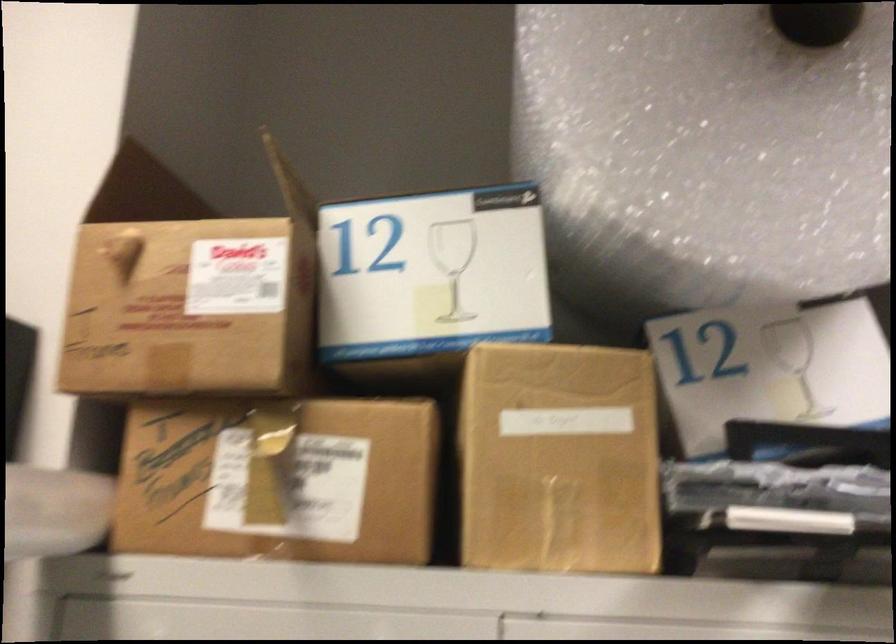
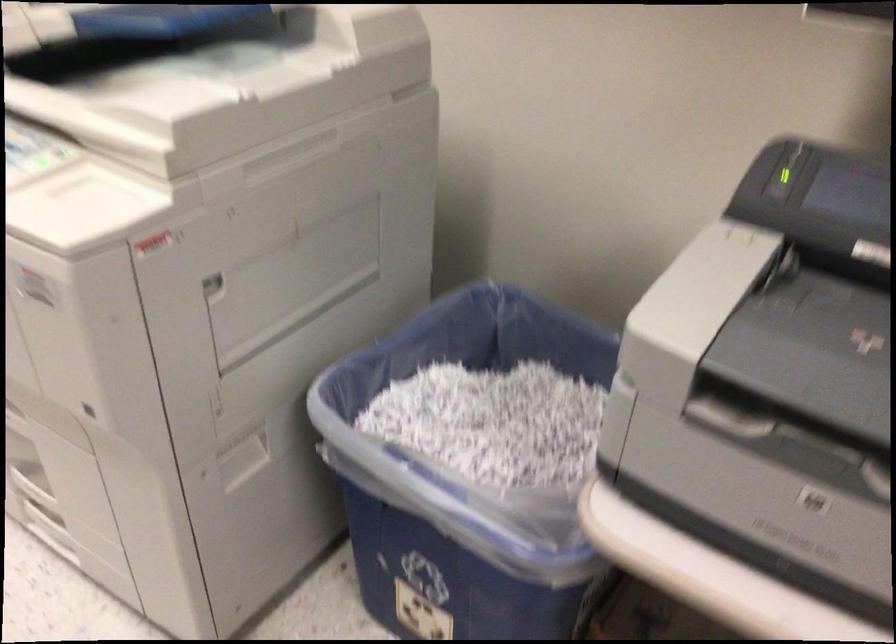
Question: What movement of the cameraman would produce the second image?

Choices:
 (A) Left
 (B) Right
 (C) Forward
 (D) Backward

Answer: (D)